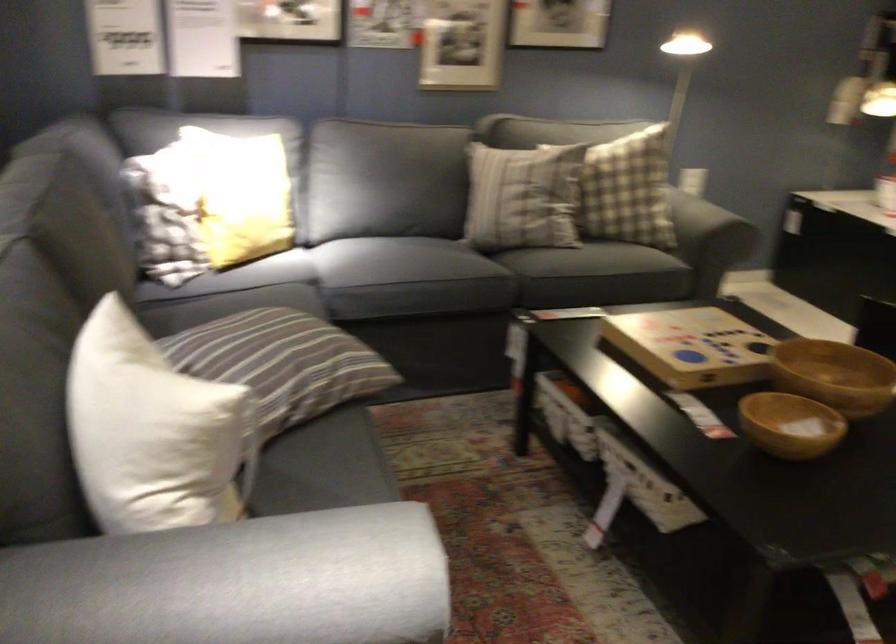
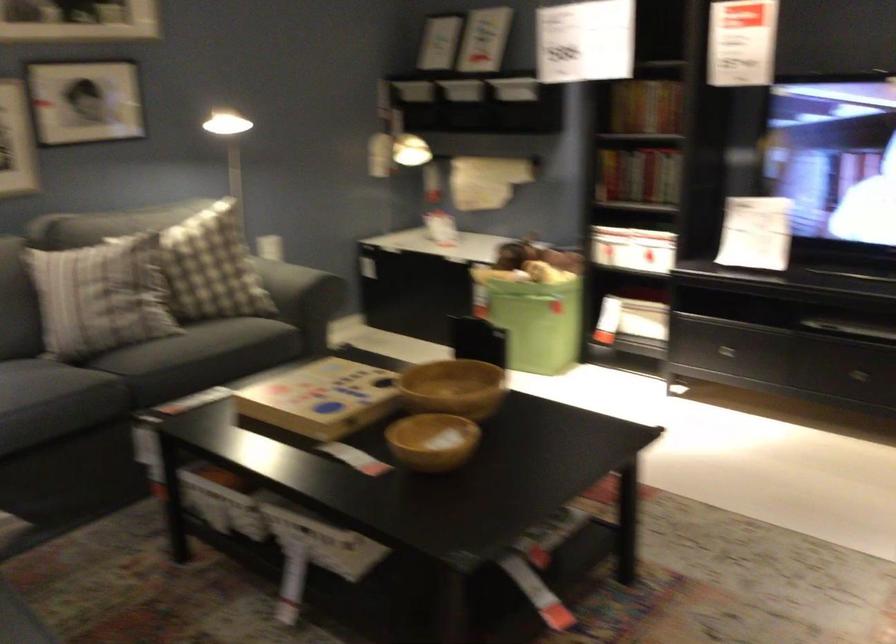
Find the pixel in the second image that matches point (784, 422) in the first image.

(433, 440)